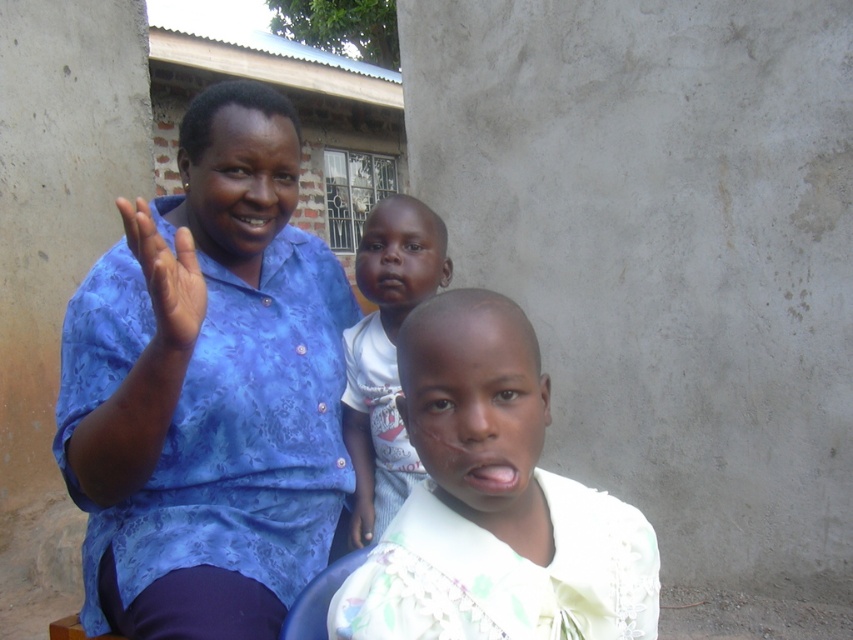
Question: Which point is farther from the camera taking this photo?

Choices:
 (A) (355, 412)
 (B) (85, 328)
 (C) (135, 212)

Answer: (A)

Question: Which object is positioned farthest from the blue fabric hand at left?

Choices:
 (A) light beige fabric shirt at center
 (B) light skin baby at center

Answer: (B)

Question: Estimate the real-world distances between objects in this image. Which object is farther from the blue printed shirt at left?

Choices:
 (A) light beige fabric shirt at center
 (B) light skin baby at center

Answer: (A)

Question: Can you confirm if blue printed shirt at left is smaller than light skin baby at center?

Choices:
 (A) yes
 (B) no

Answer: (B)

Question: Can you confirm if light beige fabric shirt at center is wider than blue fabric hand at left?

Choices:
 (A) no
 (B) yes

Answer: (B)

Question: In this image, where is blue printed shirt at left located relative to blue fabric hand at left?

Choices:
 (A) right
 (B) left

Answer: (B)